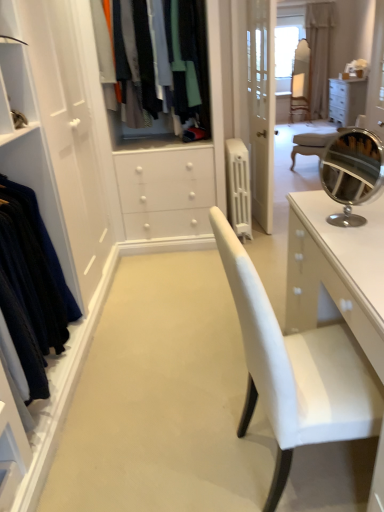
Question: Should I look upward or downward to see white plastic radiator at center?

Choices:
 (A) down
 (B) up

Answer: (B)

Question: From the image's perspective, is beige fabric curtain at upper right beneath velvet dark blue dress at left, which is the 1th clothing from bottom to top?

Choices:
 (A) no
 (B) yes

Answer: (A)

Question: Does beige fabric curtain at upper right turn towards velvet dark blue dress at left, the 2th clothing in the top-to-bottom sequence?

Choices:
 (A) no
 (B) yes

Answer: (A)

Question: From the image's perspective, is beige fabric curtain at upper right over velvet dark blue dress at left, the second clothing when ordered from back to front?

Choices:
 (A) no
 (B) yes

Answer: (B)

Question: Can you confirm if beige fabric curtain at upper right is smaller than velvet dark blue dress at left, arranged as the second clothing when viewed from the right?

Choices:
 (A) yes
 (B) no

Answer: (B)

Question: Can you confirm if beige fabric curtain at upper right is positioned to the left of velvet dark blue dress at left, arranged as the second clothing when viewed from the right?

Choices:
 (A) yes
 (B) no

Answer: (B)

Question: Is beige fabric curtain at upper right not close to velvet dark blue dress at left, arranged as the second clothing when viewed from the right?

Choices:
 (A) no
 (B) yes

Answer: (B)

Question: From a real-world perspective, is white plastic radiator at center on top of light beige fabric armchair at center?

Choices:
 (A) no
 (B) yes

Answer: (A)

Question: Does white plastic radiator at center lie behind light beige fabric armchair at center?

Choices:
 (A) yes
 (B) no

Answer: (B)

Question: From the image's perspective, does white plastic radiator at center appear higher than light beige fabric armchair at center?

Choices:
 (A) yes
 (B) no

Answer: (B)

Question: Does white plastic radiator at center appear on the left side of light beige fabric armchair at center?

Choices:
 (A) no
 (B) yes

Answer: (B)

Question: Is white plastic radiator at center thinner than light beige fabric armchair at center?

Choices:
 (A) yes
 (B) no

Answer: (B)

Question: Can you confirm if white plastic radiator at center is positioned to the right of light beige fabric armchair at center?

Choices:
 (A) yes
 (B) no

Answer: (B)

Question: Is matte fabric clothes at center, which ranks as the second clothing in bottom-to-top order, to the left of light beige fabric armchair at center from the viewer's perspective?

Choices:
 (A) no
 (B) yes

Answer: (B)